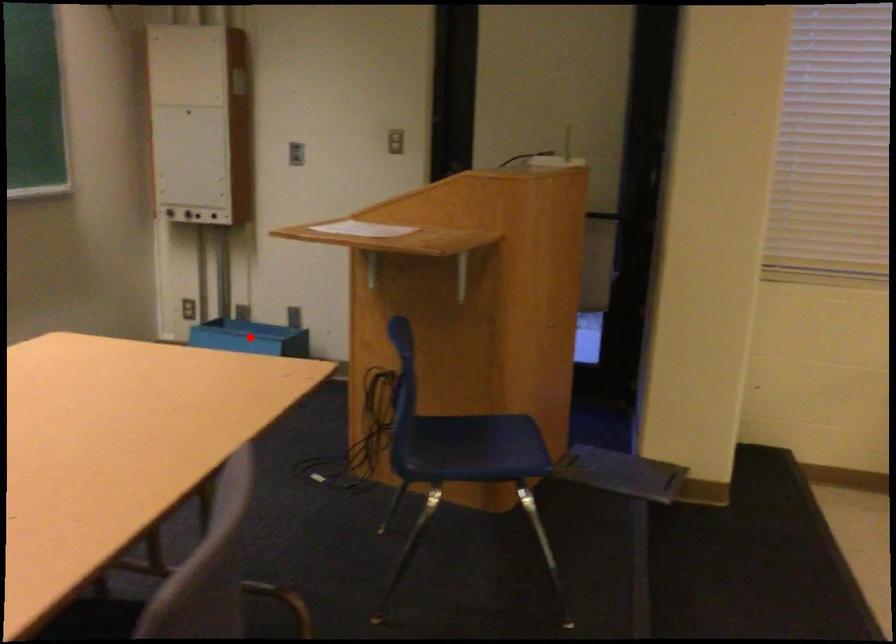
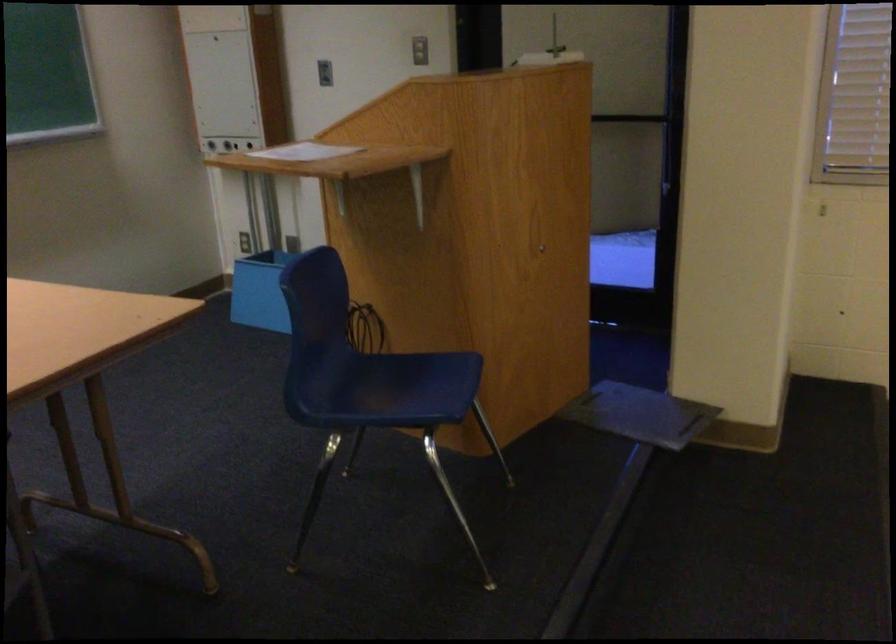
Question: I am providing you with two images of the same scene from different viewpoints. A red point is marked on the first image. Is the red point's position out of view in image 2?

Choices:
 (A) Yes
 (B) No

Answer: (A)